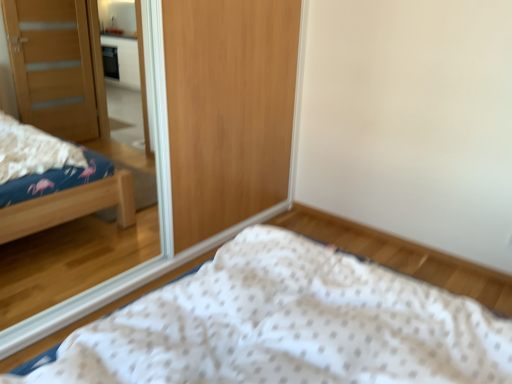
Question: Is wooden mirror at upper left wider or thinner than white dotted fabric at lower center?

Choices:
 (A) thin
 (B) wide

Answer: (A)

Question: Is wooden mirror at upper left situated inside white dotted fabric at lower center or outside?

Choices:
 (A) outside
 (B) inside

Answer: (A)

Question: Does point (159, 135) appear closer or farther from the camera than point (291, 322)?

Choices:
 (A) closer
 (B) farther

Answer: (B)

Question: Considering their positions, is white dotted fabric at lower center located in front of or behind wooden mirror at upper left?

Choices:
 (A) front
 (B) behind

Answer: (A)

Question: Does point (298, 276) appear closer or farther from the camera than point (159, 195)?

Choices:
 (A) closer
 (B) farther

Answer: (A)

Question: Considering the positions of white dotted fabric at lower center and wooden mirror at upper left in the image, is white dotted fabric at lower center wider or thinner than wooden mirror at upper left?

Choices:
 (A) thin
 (B) wide

Answer: (B)

Question: Looking at the image, does white dotted fabric at lower center seem bigger or smaller compared to wooden mirror at upper left?

Choices:
 (A) big
 (B) small

Answer: (A)